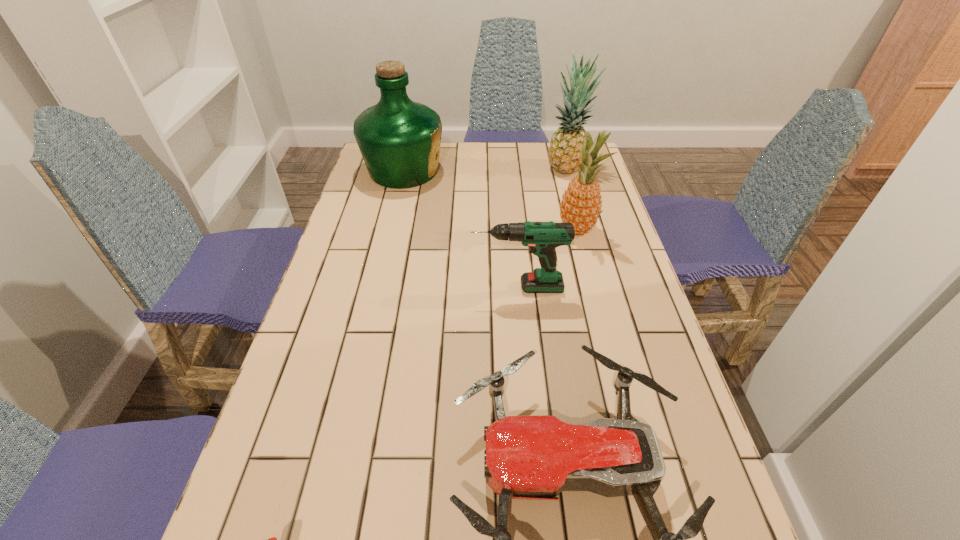
In the image, there is a desktop. Find the location of `vacant space at the far right corner`. vacant space at the far right corner is located at coordinates (549, 150).

This screenshot has width=960, height=540. What are the coordinates of `vacant region between the liquor and the nearer pineapple` in the screenshot? It's located at pos(491,200).

Locate an element on the screen. The height and width of the screenshot is (540, 960). vacant space that is in between the third nearest object and the liquor is located at coordinates (461, 229).

At what (x,y) coordinates should I click in order to perform the action: click on object that is the fourth closest to the igniter. Please return your answer as a coordinate pair (x, y). This screenshot has height=540, width=960. Looking at the image, I should click on (399, 139).

Select which object is the third closest to the igniter. Please provide its 2D coordinates. Your answer should be formatted as a tuple, i.e. [(x, y)], where the tuple contains the x and y coordinates of a point satisfying the conditions above.

[(581, 205)]

Locate an element on the screen. vacant space that satisfies the following two spatial constraints: 1. on the front side of the nearer pineapple; 2. on the handle side of the drill is located at coordinates (591, 287).